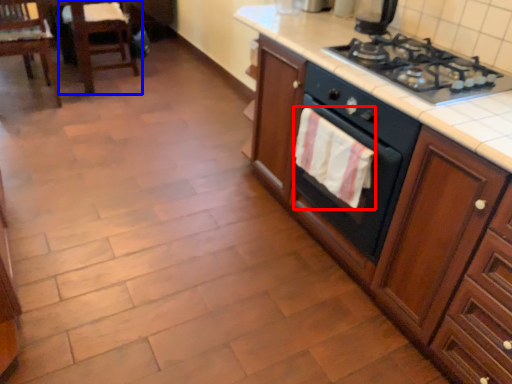
Question: Among these objects, which one is nearest to the camera, hand towel (highlighted by a red box) or chair (highlighted by a blue box)?

Choices:
 (A) hand towel
 (B) chair

Answer: (A)